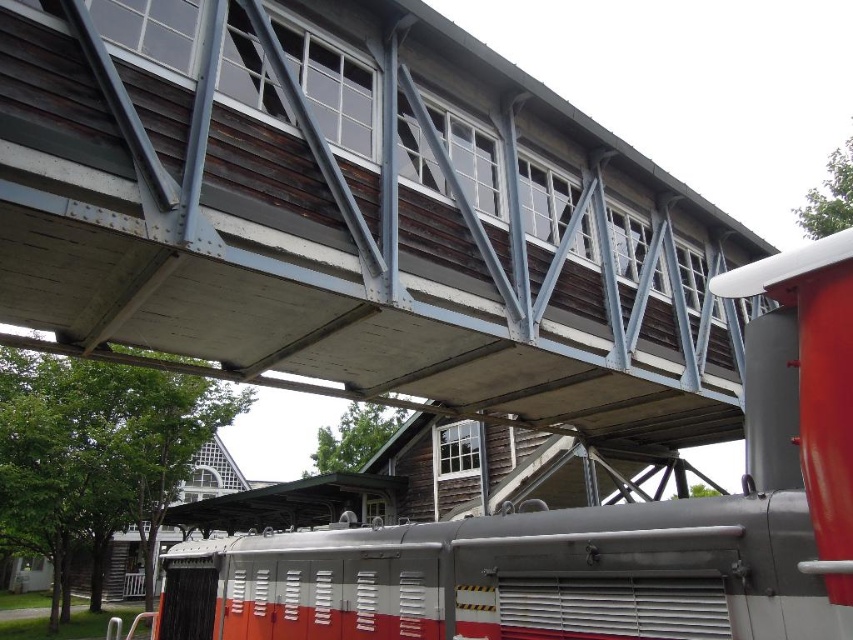
You are standing at the railway station and looking at the wooden and metal structure with windows. There are two points marked on the structure at coordinates point (483, 60) and point (630, 595). Which point is closer to your eyes?

Point (483, 60) is further to the camera than point (630, 595), so the point closer to your eyes is point (630, 595).

You are standing at the railway station and want to cross the wooden bridge at center. Based on its position, can you estimate whether it is positioned closer to the front of the locomotive or further back?

The wooden bridge at center is located at point coordinates suggesting it is positioned closer to the front of the locomotive compared to the rear section.

You are a photographer standing at the railway station. You want to take a photo that includes both the wooden bridge at center and the red and white metal train at center. Which object should you frame first to ensure both are in the shot?

You should frame the wooden bridge at center first since it is larger than the red and white metal train at center, ensuring there is enough space for both in the photo.